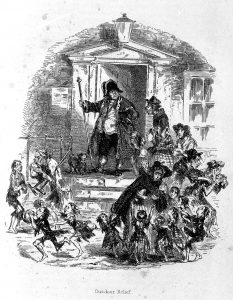
Locate an element on the screen. door is located at coordinates (128, 79).